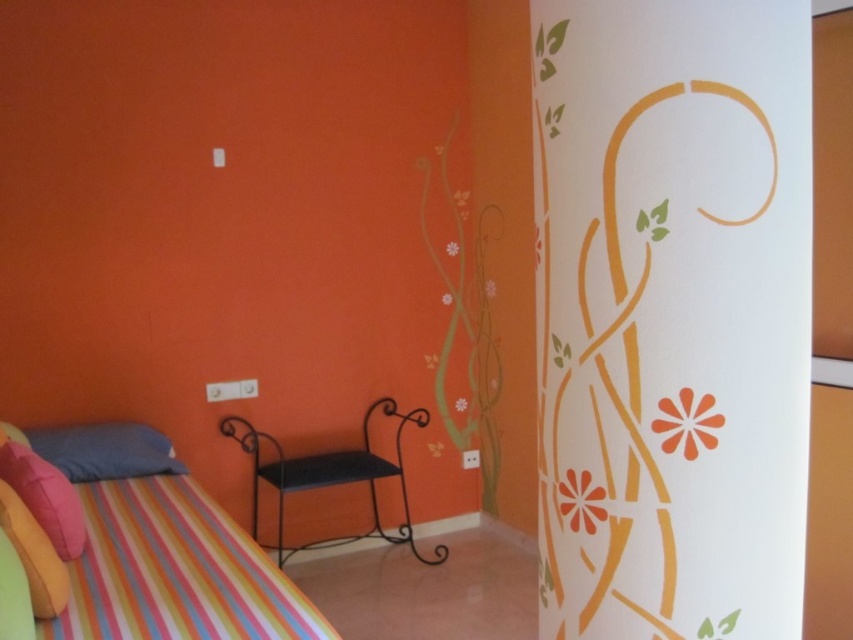
Can you confirm if black wrought iron stool at center is bigger than velvet pink pillow at lower left?

Indeed, black wrought iron stool at center has a larger size compared to velvet pink pillow at lower left.

Does black wrought iron stool at center have a lesser width compared to velvet pink pillow at lower left?

Incorrect, black wrought iron stool at center's width is not less than velvet pink pillow at lower left's.

This screenshot has width=853, height=640. What are the coordinates of `black wrought iron stool at center` in the screenshot? It's located at (332, 477).

Image resolution: width=853 pixels, height=640 pixels. Identify the location of black wrought iron stool at center. (332, 477).

Can you confirm if striped fabric bed at lower left is shorter than velvet pink pillow at lower left?

Yes, striped fabric bed at lower left is shorter than velvet pink pillow at lower left.

Can you confirm if striped fabric bed at lower left is positioned to the right of velvet pink pillow at lower left?

Indeed, striped fabric bed at lower left is positioned on the right side of velvet pink pillow at lower left.

Identify the location of striped fabric bed at lower left. The height and width of the screenshot is (640, 853). (175, 572).

Which is more to the left, striped fabric bed at lower left or black wrought iron stool at center?

From the viewer's perspective, striped fabric bed at lower left appears more on the left side.

Does striped fabric bed at lower left have a lesser width compared to black wrought iron stool at center?

Indeed, striped fabric bed at lower left has a lesser width compared to black wrought iron stool at center.

Who is more distant from viewer, (303,605) or (401,538)?

Point (401,538)

Image resolution: width=853 pixels, height=640 pixels. In order to click on striped fabric bed at lower left in this screenshot , I will do `click(175, 572)`.